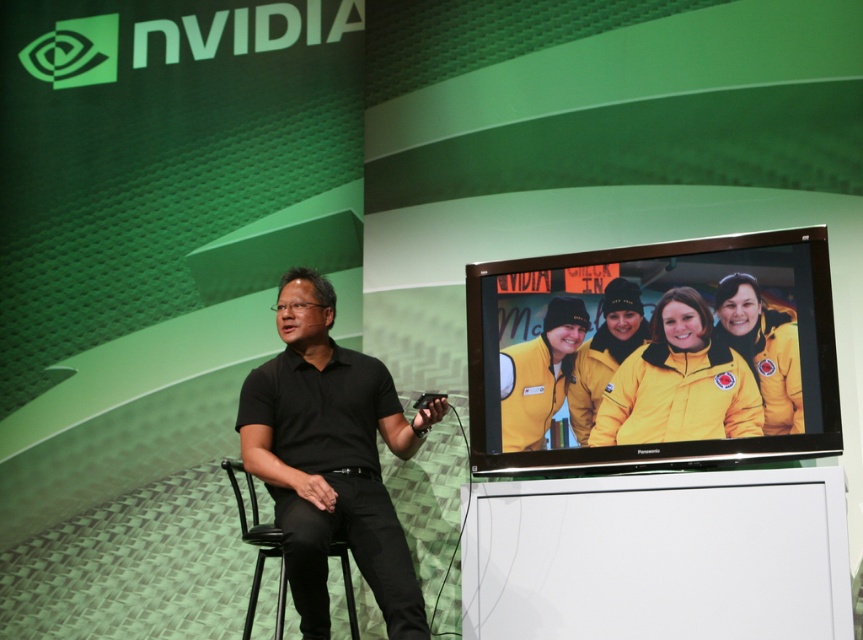
You are an event organizer who needs to ensure there is enough space between the presenter and their chair for a microphone stand. The microphone stand requires at least 12 inches of space. Based on the image, can the presenter move freely between the black matte shirt at center and the black plastic chair at center without the stand hitting anything?

The black matte shirt at center and black plastic chair at center are 10.49 inches apart from each other. Since the required space is 12 inches, the distance is insufficient for the microphone stand. The presenter may not have enough space to move freely without the stand hitting the chair.